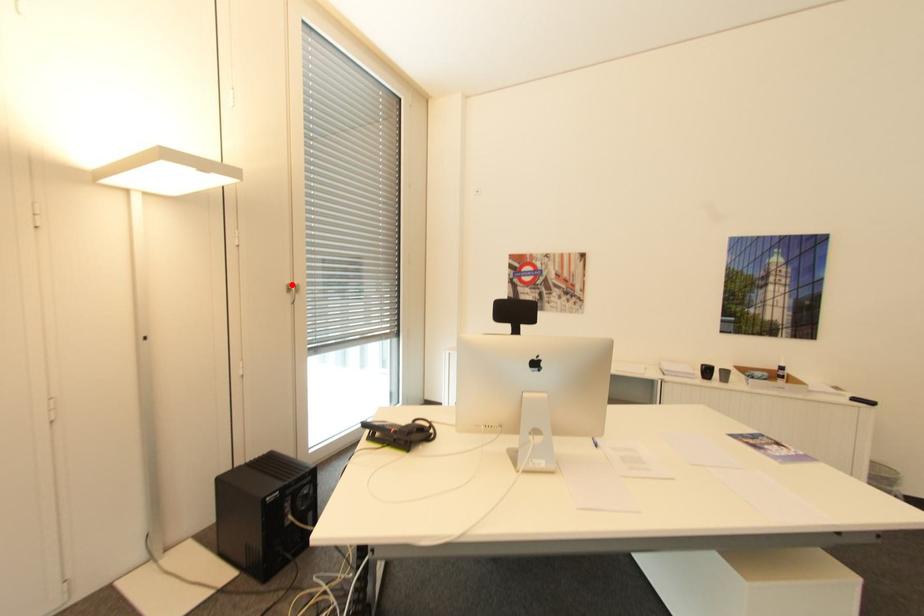
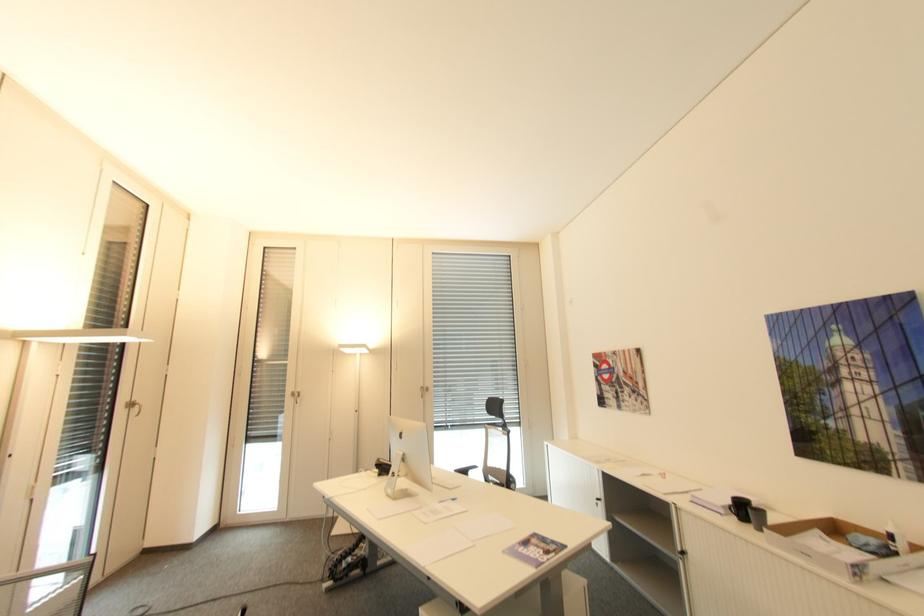
Question: A red point is marked in image1. In image2, is the corresponding 3D point closer to the camera or farther? Reply with the corresponding letter.

Choices:
 (A) The corresponding 3D point is closer.
 (B) The corresponding 3D point is farther.

Answer: (B)